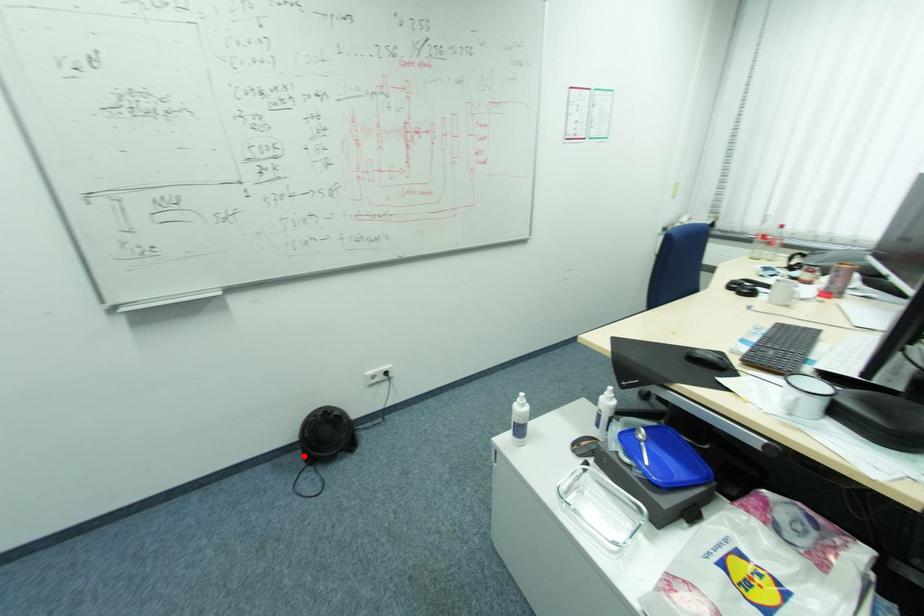
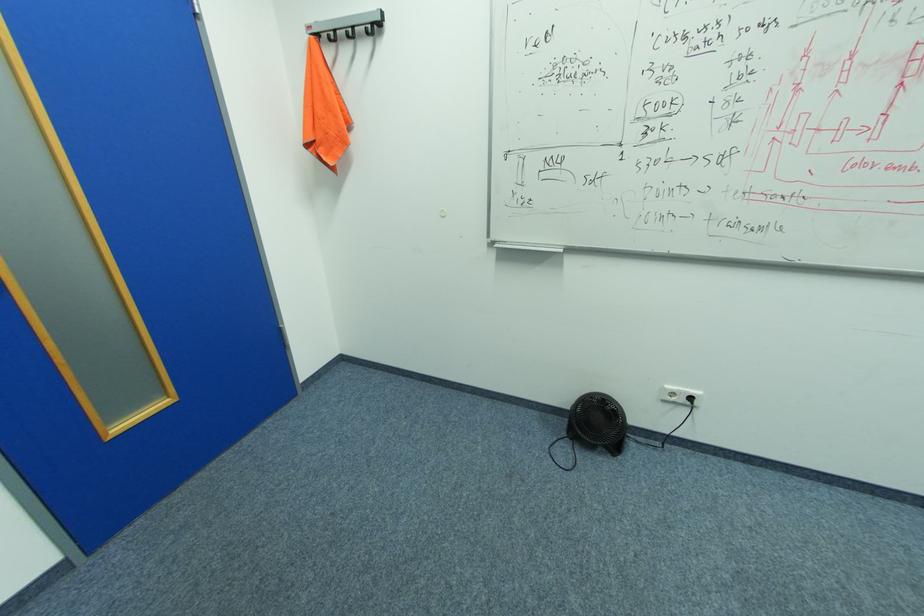
In the second image, find the point that corresponds to the highlighted location in the first image.

(568, 423)